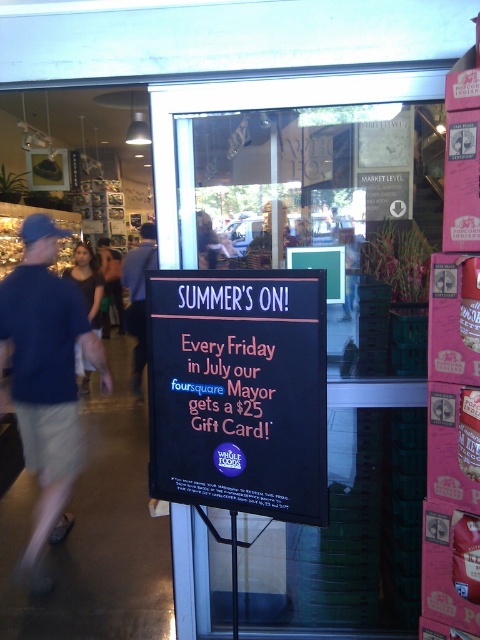
Where is `black matte sign at center`? black matte sign at center is located at coordinates (239, 390).

Who is lower down, black matte sign at center or denim jacket at lower left?

Positioned lower is black matte sign at center.

Between point (261, 381) and point (96, 317), which one is positioned behind?

Positioned behind is point (96, 317).

In order to click on black matte sign at center in this screenshot , I will do `click(239, 390)`.

Does blue fabric shorts at lower left have a greater width compared to denim jacket at lower left?

Yes, blue fabric shorts at lower left is wider than denim jacket at lower left.

Can you confirm if blue fabric shorts at lower left is shorter than denim jacket at lower left?

No.

Describe the element at coordinates (46, 381) in the screenshot. I see `blue fabric shorts at lower left` at that location.

The image size is (480, 640). I want to click on blue fabric shorts at lower left, so click(x=46, y=381).

Does point (196, 364) come closer to viewer compared to point (84, 298)?

Yes.

Is pink neon sign at center in front of denim jacket at lower left?

Yes, it is.

I want to click on pink neon sign at center, so click(x=226, y=385).